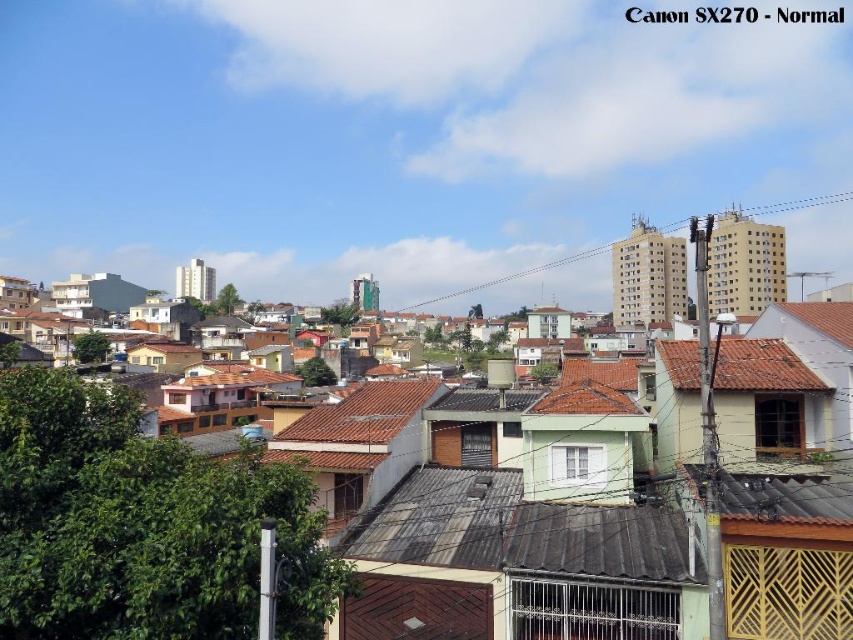
Question: Can you confirm if brown tile roof at center-right is thinner than brown tile roof at center?

Choices:
 (A) no
 (B) yes

Answer: (B)

Question: Which object is closer to the camera taking this photo?

Choices:
 (A) brown tile roof at center-right
 (B) brown tile roof at center

Answer: (A)

Question: Does brown tile roof at center-right appear on the left side of brown tile roof at center?

Choices:
 (A) no
 (B) yes

Answer: (A)

Question: Which point is closer to the camera taking this photo?

Choices:
 (A) (344, 436)
 (B) (773, 348)

Answer: (A)

Question: Where is brown tile roof at center-right located in relation to brown tile roof at center in the image?

Choices:
 (A) above
 (B) below

Answer: (A)